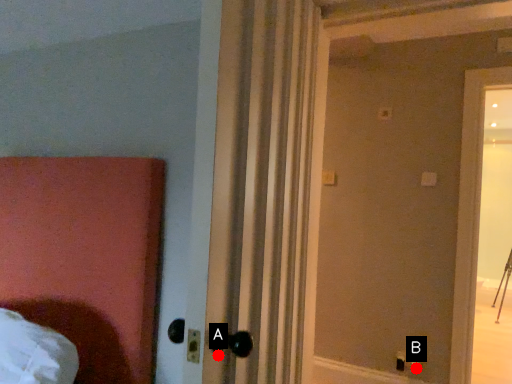
Question: Two points are circled on the image, labeled by A and B beside each circle. Which point is farther to the camera?

Choices:
 (A) A is further
 (B) B is further

Answer: (B)